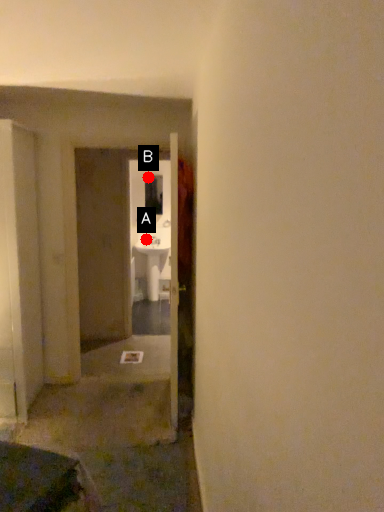
Question: Two points are circled on the image, labeled by A and B beside each circle. Which point is farther from the camera taking this photo?

Choices:
 (A) A is further
 (B) B is further

Answer: (B)